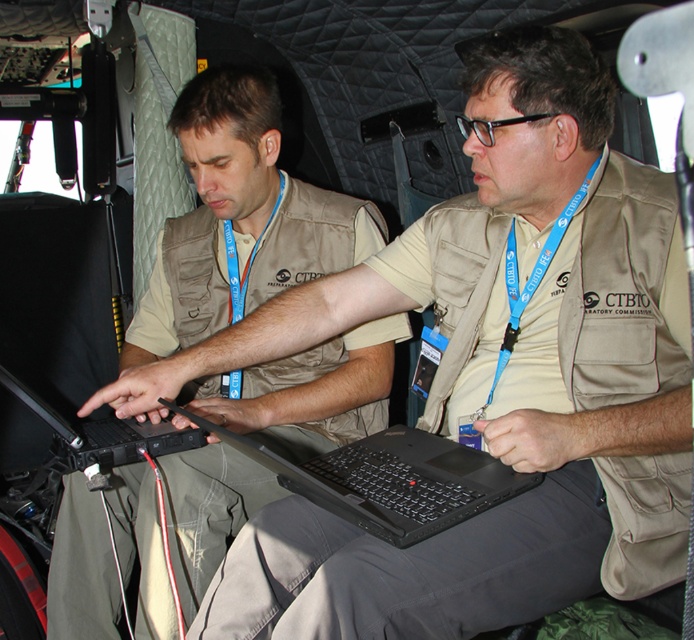
Question: From the image, what is the correct spatial relationship of matte khaki vest at center in relation to blue fabric lanyard at center?

Choices:
 (A) left
 (B) right

Answer: (A)

Question: Which point appears farthest from the camera in this image?

Choices:
 (A) (42, 440)
 (B) (493, 387)
 (C) (282, 476)
 (D) (282, 419)

Answer: (A)

Question: Among these objects, which one is farthest from the camera?

Choices:
 (A) black matte laptop at center
 (B) matte khaki vest at center
 (C) blue fabric lanyard at center
 (D) black plastic laptop at center

Answer: (B)

Question: Estimate the real-world distances between objects in this image. Which object is closer to the blue fabric lanyard at center?

Choices:
 (A) black plastic laptop at center
 (B) matte khaki vest at center

Answer: (A)

Question: From the image, what is the correct spatial relationship of matte khaki vest at center in relation to black plastic laptop at center?

Choices:
 (A) right
 (B) left

Answer: (B)

Question: Does matte khaki vest at center appear over black plastic laptop at center?

Choices:
 (A) yes
 (B) no

Answer: (A)